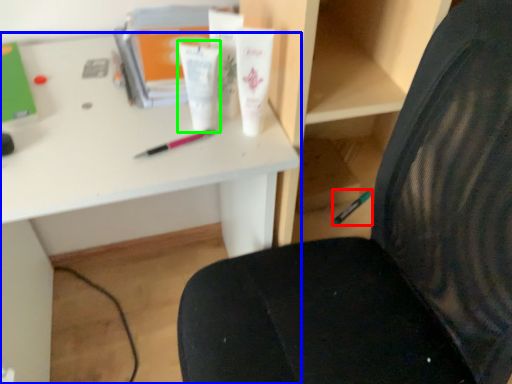
Question: Estimate the real-world distances between objects in this image. Which object is farther from stationery (highlighted by a red box), desk (highlighted by a blue box) or toiletry (highlighted by a green box)?

Choices:
 (A) desk
 (B) toiletry

Answer: (B)